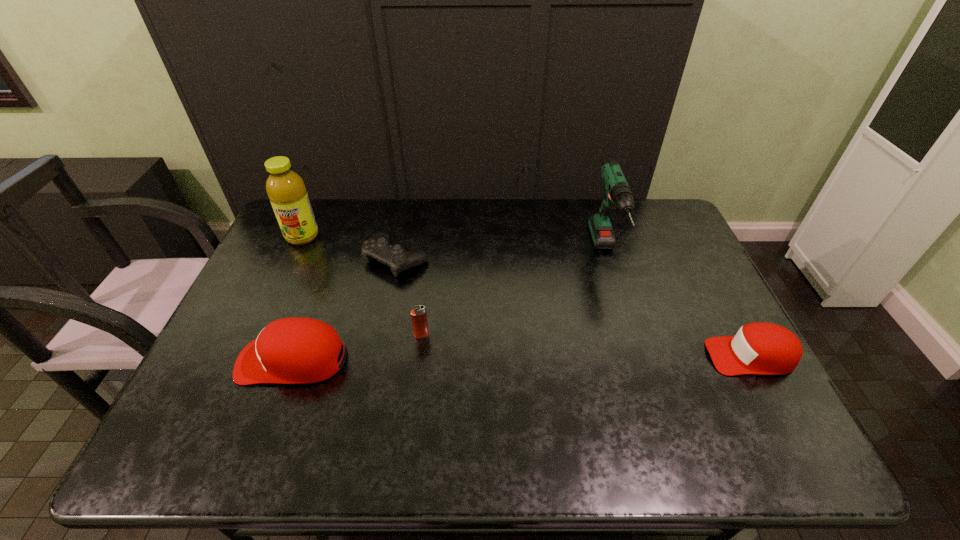
To make them evenly spaced by inserting another baseball_cap among them, please locate a vacant spot for this new baseball_cap. Please provide its 2D coordinates. Your answer should be formatted as a tuple, i.e. [(x, y)], where the tuple contains the x and y coordinates of a point satisfying the conditions above.

[(522, 358)]